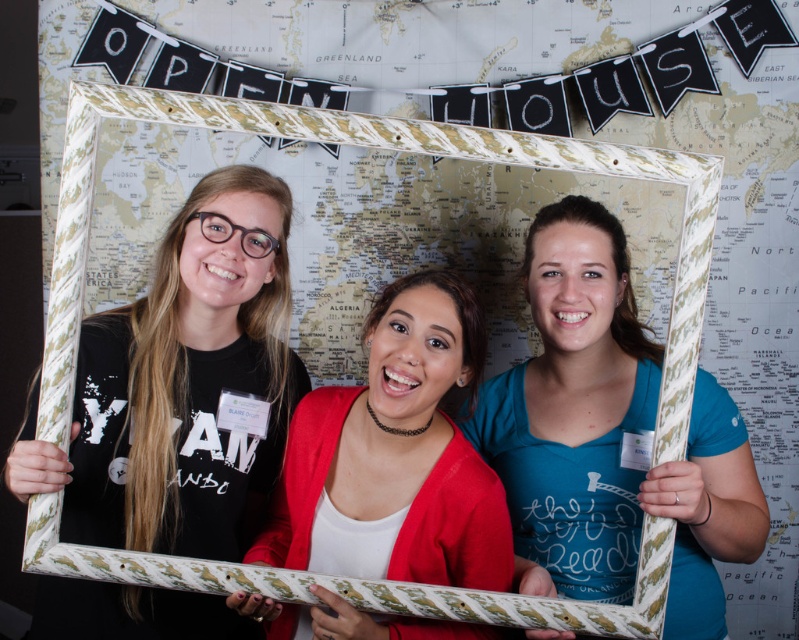
Question: Is matte black frame at center positioned before matte red cardigan at center?

Choices:
 (A) yes
 (B) no

Answer: (A)

Question: Which object is farther from the camera taking this photo?

Choices:
 (A) matte red cardigan at center
 (B) matte gold frame at center
 (C) matte black frame at center
 (D) wooden frame at center

Answer: (A)

Question: Is matte red cardigan at center smaller than wooden frame at center?

Choices:
 (A) yes
 (B) no

Answer: (A)

Question: Can you confirm if matte black frame at center is positioned above matte gold frame at center?

Choices:
 (A) yes
 (B) no

Answer: (A)

Question: Which point is farther to the camera?

Choices:
 (A) matte red cardigan at center
 (B) wooden frame at center

Answer: (A)

Question: Which of the following is the closest to the observer?

Choices:
 (A) matte gold frame at center
 (B) matte black frame at center
 (C) matte red cardigan at center
 (D) wooden frame at center

Answer: (B)